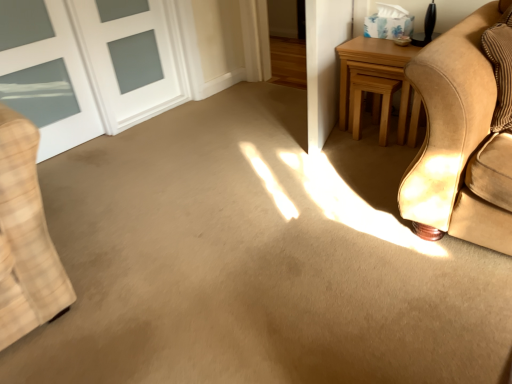
Question: Considering the relative sizes of white glass door at upper left and light brown wood stool at upper right in the image provided, is white glass door at upper left smaller than light brown wood stool at upper right?

Choices:
 (A) yes
 (B) no

Answer: (B)

Question: Does white glass door at upper left have a greater width compared to light brown wood stool at upper right?

Choices:
 (A) yes
 (B) no

Answer: (B)

Question: Is white glass door at upper left in front of light brown wood stool at upper right?

Choices:
 (A) no
 (B) yes

Answer: (B)

Question: Is white glass door at upper left shorter than light brown wood stool at upper right?

Choices:
 (A) no
 (B) yes

Answer: (A)

Question: Does white glass door at upper left contain light brown wood stool at upper right?

Choices:
 (A) no
 (B) yes

Answer: (A)

Question: Can you confirm if white glass door at upper left is bigger than light brown wood stool at upper right?

Choices:
 (A) yes
 (B) no

Answer: (A)

Question: From the image's perspective, is white glass door at upper left located beneath light brown wooden table at right?

Choices:
 (A) yes
 (B) no

Answer: (B)

Question: Is white glass door at upper left behind light brown wooden table at right?

Choices:
 (A) no
 (B) yes

Answer: (A)

Question: From the image's perspective, is white glass door at upper left located above light brown wooden table at right?

Choices:
 (A) no
 (B) yes

Answer: (B)

Question: Is white glass door at upper left looking in the opposite direction of light brown wooden table at right?

Choices:
 (A) yes
 (B) no

Answer: (B)

Question: Is white glass door at upper left placed right next to light brown wooden table at right?

Choices:
 (A) no
 (B) yes

Answer: (A)

Question: Is light brown wooden table at right surrounded by white glass door at upper left?

Choices:
 (A) yes
 (B) no

Answer: (B)

Question: Is light brown wood stool at upper right at the left side of white glass door at upper left?

Choices:
 (A) yes
 (B) no

Answer: (B)